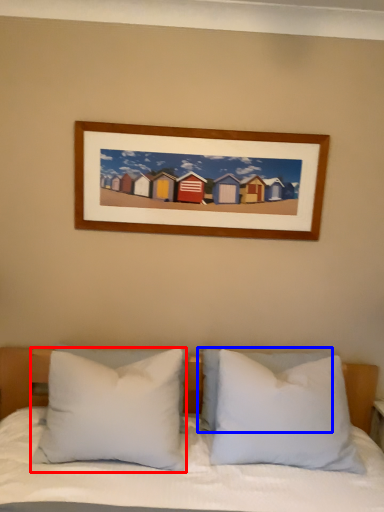
Question: Which point is closer to the camera, pillow (highlighted by a red box) or pillow (highlighted by a blue box)?

Choices:
 (A) pillow
 (B) pillow

Answer: (A)